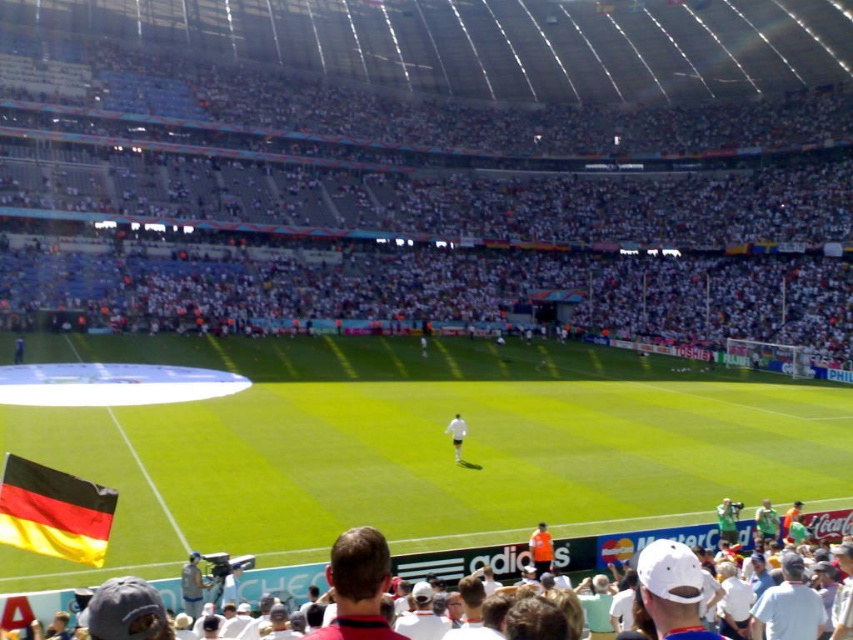
Could you measure the distance between white fabric crowd at upper center and black and yellow fabric flag at lower left?

white fabric crowd at upper center is 65.56 meters away from black and yellow fabric flag at lower left.

Is point (299, 218) closer to viewer compared to point (57, 545)?

No.

Where is `white fabric crowd at upper center`? white fabric crowd at upper center is located at coordinates (421, 160).

Which is above, white matte shirt at center or black and yellow fabric flag at lower left?

black and yellow fabric flag at lower left

Which is in front, point (709, 532) or point (50, 554)?

Positioned in front is point (50, 554).

Measure the distance between white matte shirt at center and camera.

white matte shirt at center and camera are 45.65 feet apart from each other.

At what (x,y) coordinates should I click in order to perform the action: click on white matte shirt at center. Please return your answer as a coordinate pair (x, y). The height and width of the screenshot is (640, 853). Looking at the image, I should click on (624, 545).

Does orange jersey at center have a lesser width compared to white matte soccer player at center?

No, orange jersey at center is not thinner than white matte soccer player at center.

Does point (544, 541) come in front of point (451, 422)?

Yes, point (544, 541) is closer to viewer.

You are a GUI agent. You are given a task and a screenshot of the screen. Output one action in this format:
    pyautogui.click(x=<x>, y=<y>)
    Task: Click on the orange jersey at center
    Image resolution: width=853 pixels, height=640 pixels.
    Given the screenshot: What is the action you would take?
    pyautogui.click(x=540, y=548)